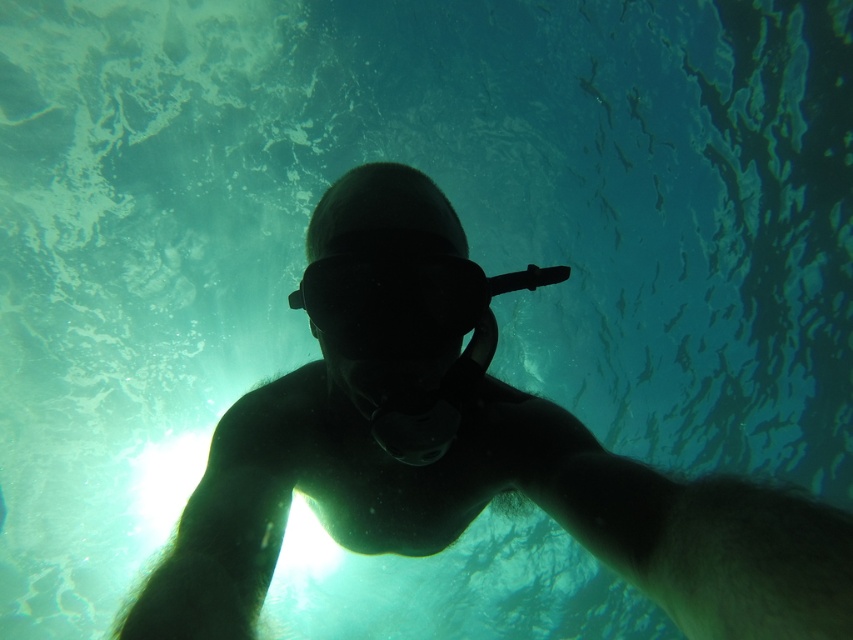
Question: Which point is farther to the camera?

Choices:
 (A) (469, 472)
 (B) (360, 333)

Answer: (A)

Question: Is silhouette snorkel at center to the right of black matte goggles at center from the viewer's perspective?

Choices:
 (A) no
 (B) yes

Answer: (A)

Question: Which of the following is the closest to the observer?

Choices:
 (A) black matte goggles at center
 (B) silhouette snorkel at center

Answer: (B)

Question: Which object is farther from the camera taking this photo?

Choices:
 (A) black matte goggles at center
 (B) silhouette snorkel at center

Answer: (A)

Question: Is silhouette snorkel at center thinner than black matte goggles at center?

Choices:
 (A) yes
 (B) no

Answer: (B)

Question: In this image, where is silhouette snorkel at center located relative to black matte goggles at center?

Choices:
 (A) below
 (B) above

Answer: (A)